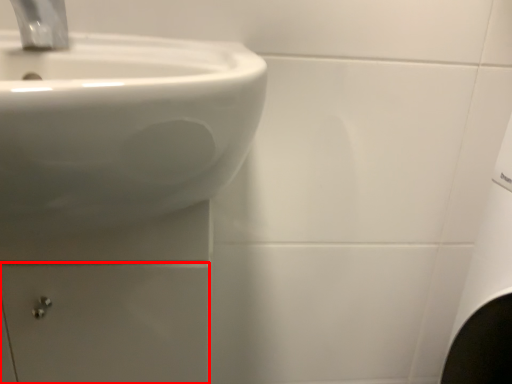
Question: From the image's perspective, what is the correct spatial positioning of drawer (annotated by the red box) in reference to tap?

Choices:
 (A) above
 (B) below

Answer: (B)